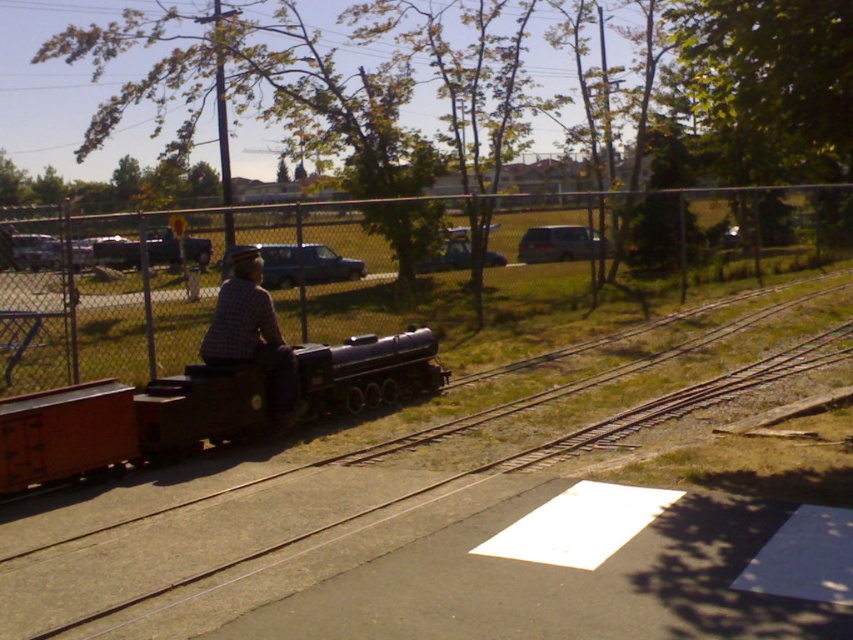
Question: Can you confirm if metal chain-link fence at center is bigger than matte blue car at center?

Choices:
 (A) yes
 (B) no

Answer: (A)

Question: Which point appears closest to the camera in this image?

Choices:
 (A) (440, 252)
 (B) (196, 394)
 (C) (265, 253)

Answer: (B)

Question: Is smooth black train track at center to the left of matte silver suv at center from the viewer's perspective?

Choices:
 (A) yes
 (B) no

Answer: (A)

Question: Which point is closer to the camera?

Choices:
 (A) (572, 305)
 (B) (607, 250)
 (C) (486, 260)
 (D) (328, 260)

Answer: (D)

Question: Observing the image, what is the correct spatial positioning of smooth black train track at center in reference to matte blue car at center?

Choices:
 (A) left
 (B) right

Answer: (B)

Question: Which of the following is the farthest from the observer?

Choices:
 (A) (244, 342)
 (B) (503, 460)

Answer: (A)